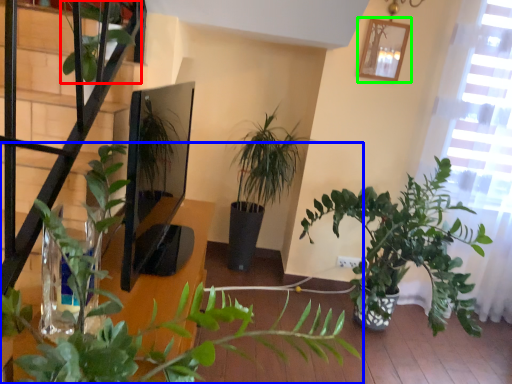
Question: Which object is the closest to the vegetation (highlighted by a red box)? Choose among these: houseplant (highlighted by a blue box) or picture frame (highlighted by a green box).

Choices:
 (A) houseplant
 (B) picture frame

Answer: (A)